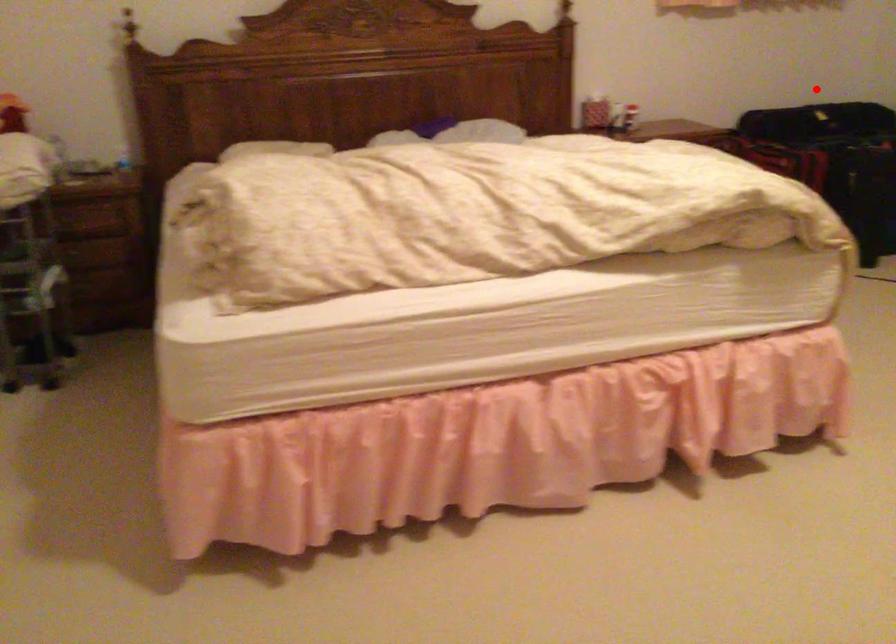
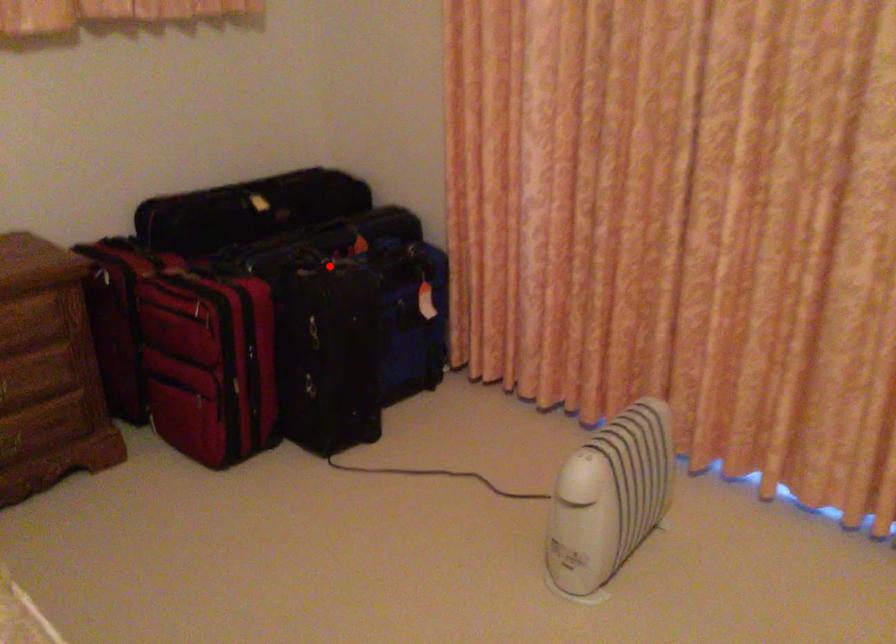
I am providing you with two images of the same scene from different viewpoints. A red point is marked on the first image and another point is marked on the second image. Are the points marked in image1 and image2 representing the same 3D position?

No